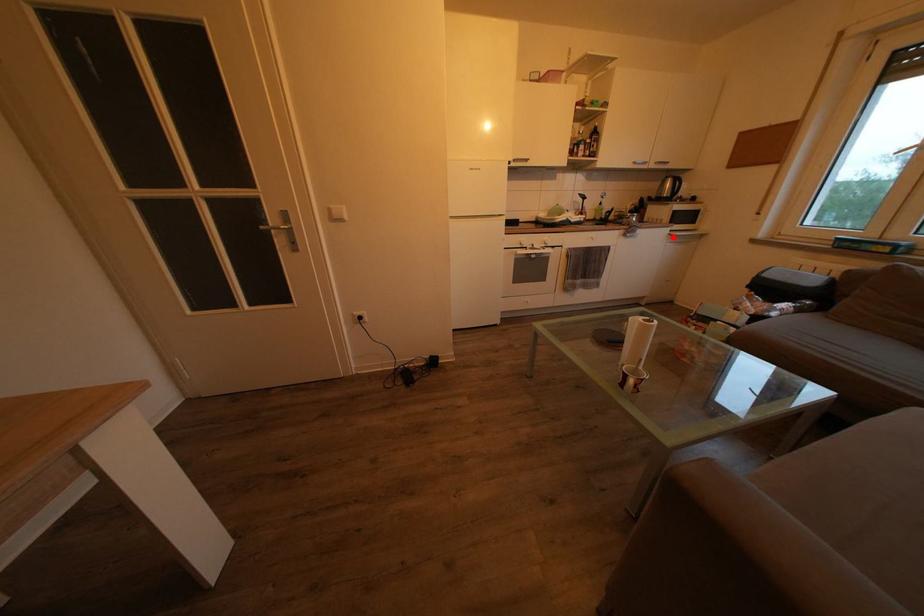
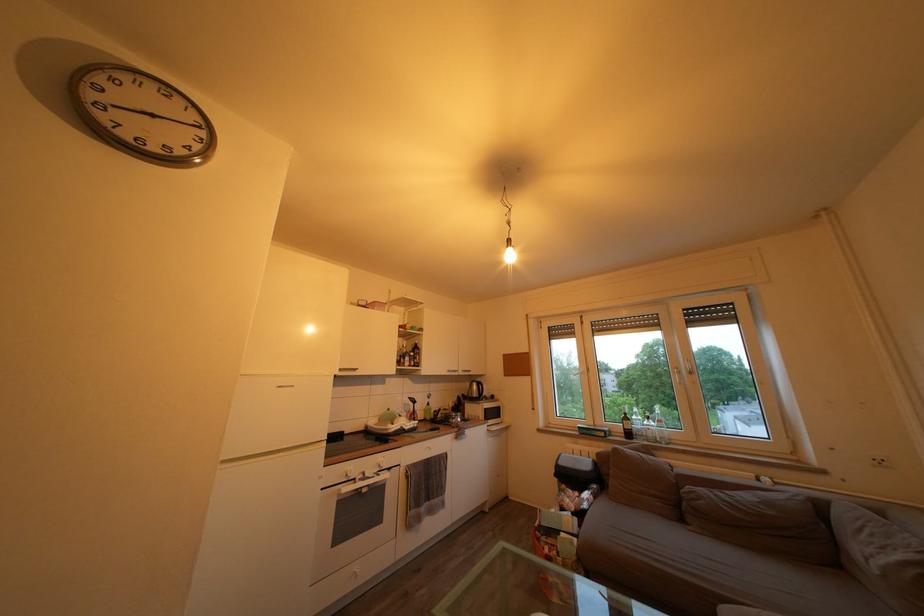
Question: I am providing you with two images of the same scene from different viewpoints. Given a red point in image1, look at the same physical point in image2. Is it:

Choices:
 (A) Closer to the viewpoint
 (B) Farther from the viewpoint

Answer: (B)